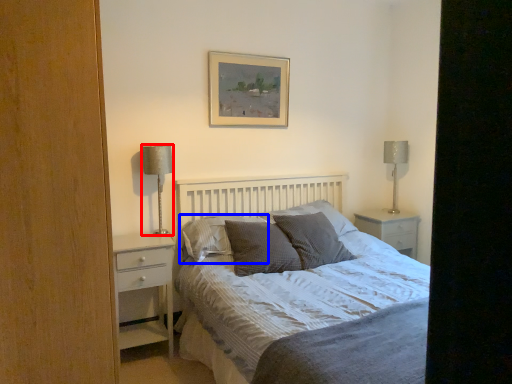
Question: Which point is closer to the camera, table lamp (highlighted by a red box) or pillow (highlighted by a blue box)?

Choices:
 (A) table lamp
 (B) pillow

Answer: (B)